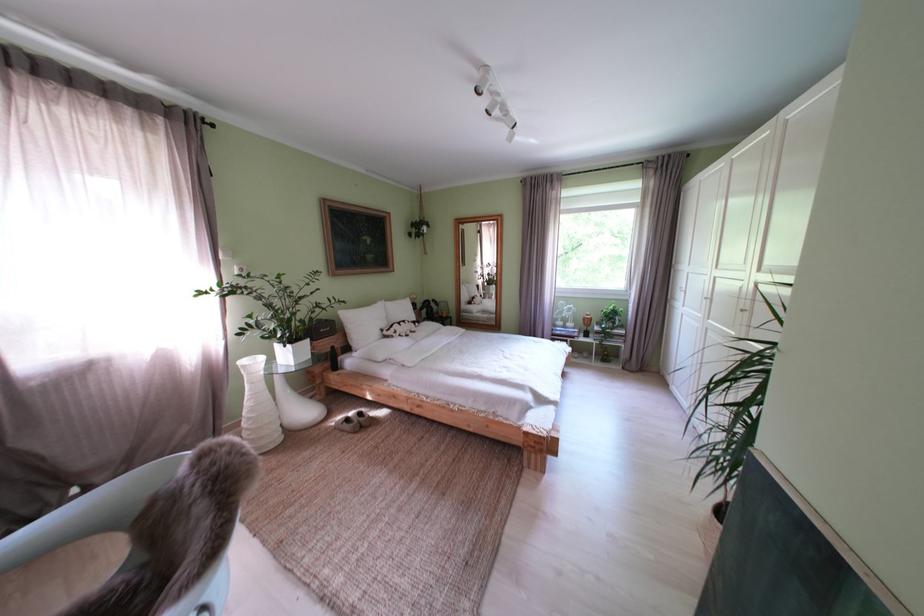
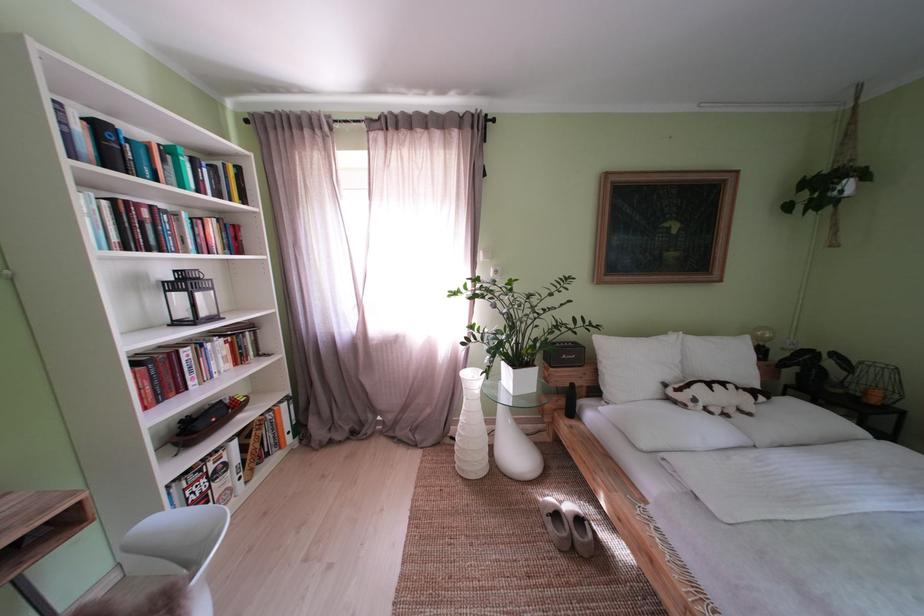
Locate, in the second image, the point that corresponds to point (373, 330) in the first image.

(639, 369)